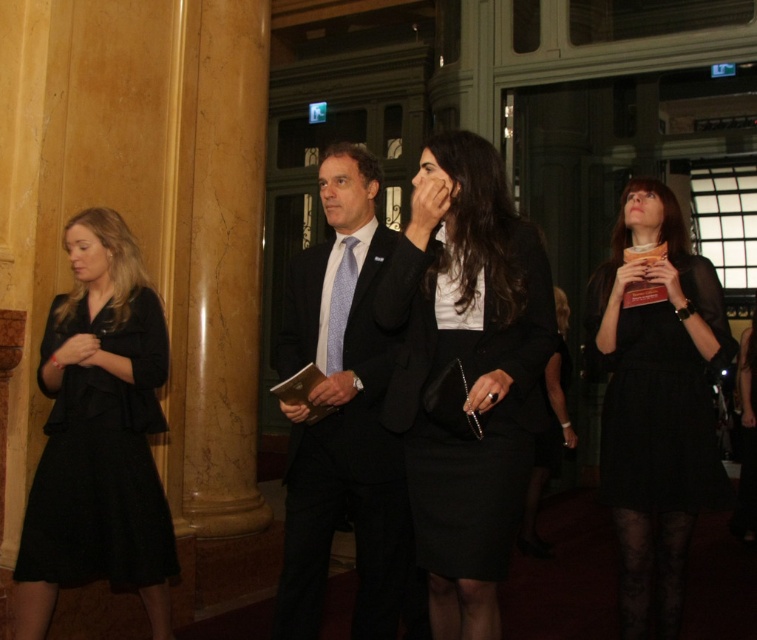
Question: Does matte black suit at center have a smaller size compared to black matte dress at left?

Choices:
 (A) yes
 (B) no

Answer: (B)

Question: Can you confirm if matte black dress at center is smaller than black satin dress at right?

Choices:
 (A) yes
 (B) no

Answer: (B)

Question: Does matte black suit at center appear over black matte dress at left?

Choices:
 (A) yes
 (B) no

Answer: (A)

Question: Which of these objects is positioned farthest from the black satin dress at right?

Choices:
 (A) matte black suit at center
 (B) black matte dress at left
 (C) light blue textured tie at center

Answer: (B)

Question: Which of the following is the farthest from the observer?

Choices:
 (A) black satin dress at right
 (B) light blue textured tie at center
 (C) matte black dress at center
 (D) matte black suit at center

Answer: (A)

Question: Which point is closer to the camera taking this photo?

Choices:
 (A) (346, 310)
 (B) (150, 525)
 (C) (416, 621)

Answer: (A)